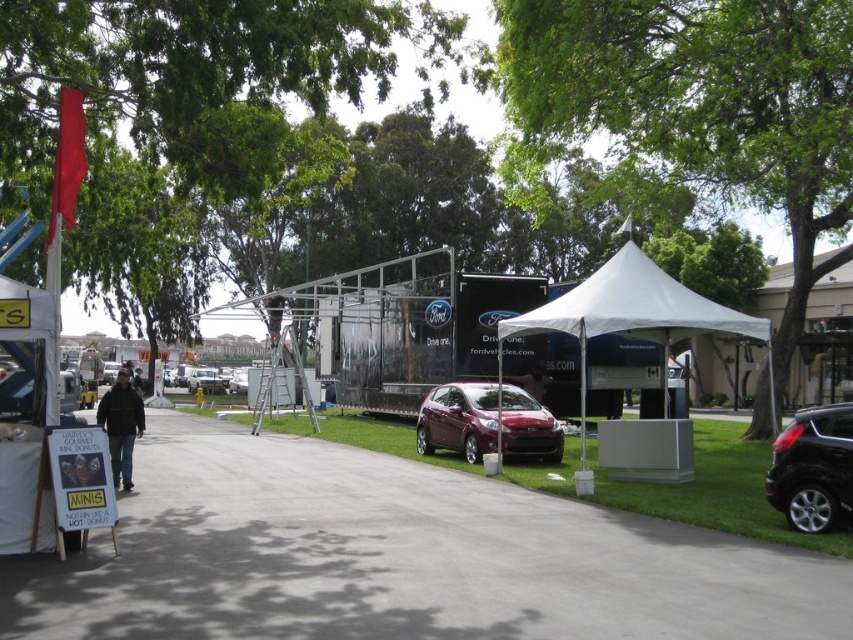
You are at the outdoor event and want to find the satin burgundy car at center. According to the image coordinates, where exactly is it positioned?

The satin burgundy car at center is located at point [486,422].

What are the coordinates of the satin burgundy car at center?

The satin burgundy car at center is located at coordinates point (486, 422).